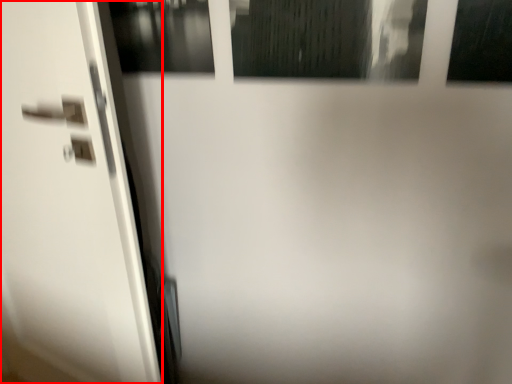
Question: From the image's perspective, considering the relative positions of screen door (annotated by the red box) and window in the image provided, where is screen door (annotated by the red box) located with respect to the staircase?

Choices:
 (A) below
 (B) above

Answer: (A)